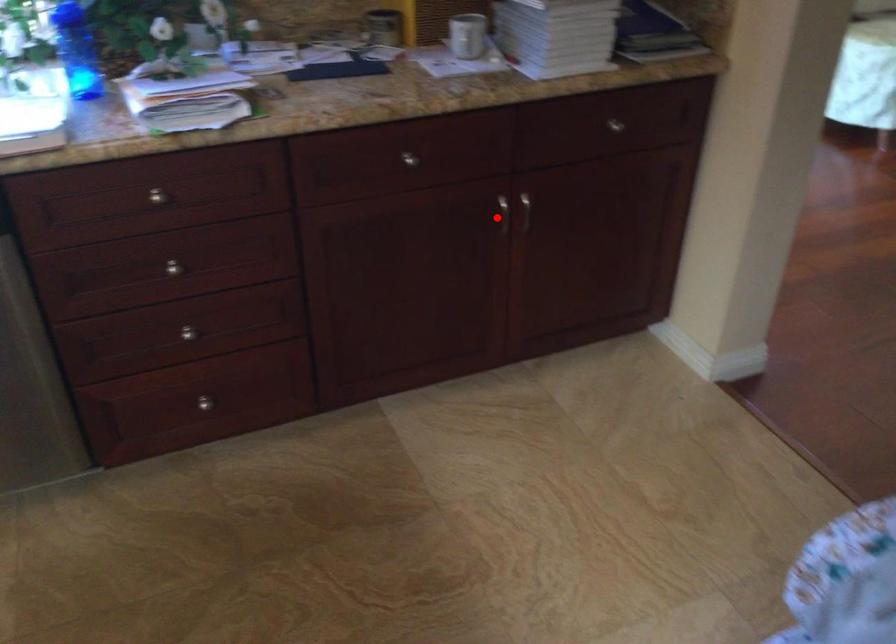
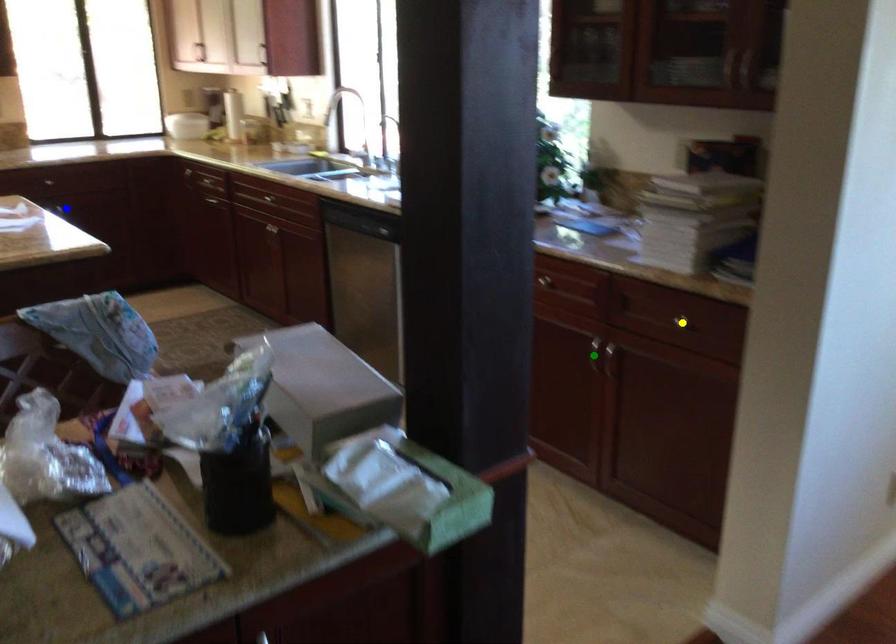
Question: I am providing you with two images of the same scene from different viewpoints. A red point is marked on the first image. You are given multiple points on the second image. Can you choose the point in image 2 that corresponds to the point in image 1?

Choices:
 (A) green point
 (B) blue point
 (C) yellow point

Answer: (A)